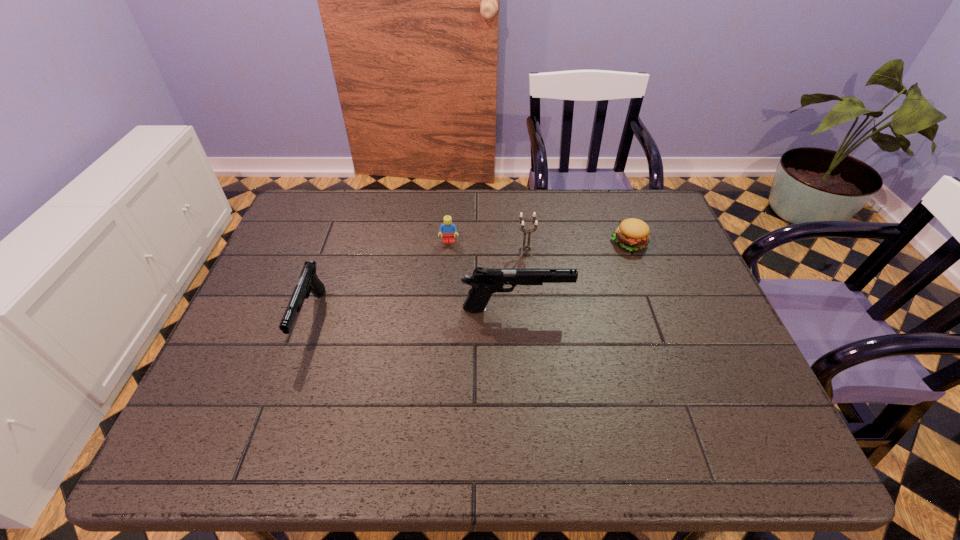
Locate an element on the screen. vacant space at the far right corner of the desktop is located at coordinates (660, 204).

In the image, there is a desktop. At what (x,y) coordinates should I click in order to perform the action: click on vacant space at the near right corner. Please return your answer as a coordinate pair (x, y). The width and height of the screenshot is (960, 540). Looking at the image, I should click on (732, 411).

I want to click on vacant space that's between the right gun and the leftmost object, so click(x=414, y=314).

I want to click on free point between the candle holder and the Lego, so click(487, 247).

Image resolution: width=960 pixels, height=540 pixels. I want to click on free space that is in between the fourth tallest object and the shortest object, so click(539, 242).

The image size is (960, 540). Identify the location of vacant space that is in between the fourth object from right to left and the hamburger. (539, 242).

Locate which object ranks in proximity to the right gun. Please provide its 2D coordinates. Your answer should be formatted as a tuple, i.e. [(x, y)], where the tuple contains the x and y coordinates of a point satisfying the conditions above.

[(521, 221)]

Where is `the fourth closest object to the Lego`? The width and height of the screenshot is (960, 540). the fourth closest object to the Lego is located at coordinates (632, 234).

Find the location of a particular element. The width and height of the screenshot is (960, 540). free space that satisfies the following two spatial constraints: 1. at the aiming end of the taller gun; 2. at the aiming end of the left gun is located at coordinates (516, 319).

At what (x,y) coordinates should I click in order to perform the action: click on free space that satisfies the following two spatial constraints: 1. at the aiming end of the taller gun; 2. at the aiming end of the leftmost object. Please return your answer as a coordinate pair (x, y). Looking at the image, I should click on (516, 319).